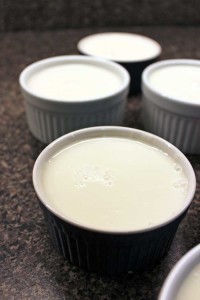
Image resolution: width=200 pixels, height=300 pixels. What are the coordinates of `rim of ramikin` in the screenshot? It's located at (56, 105).